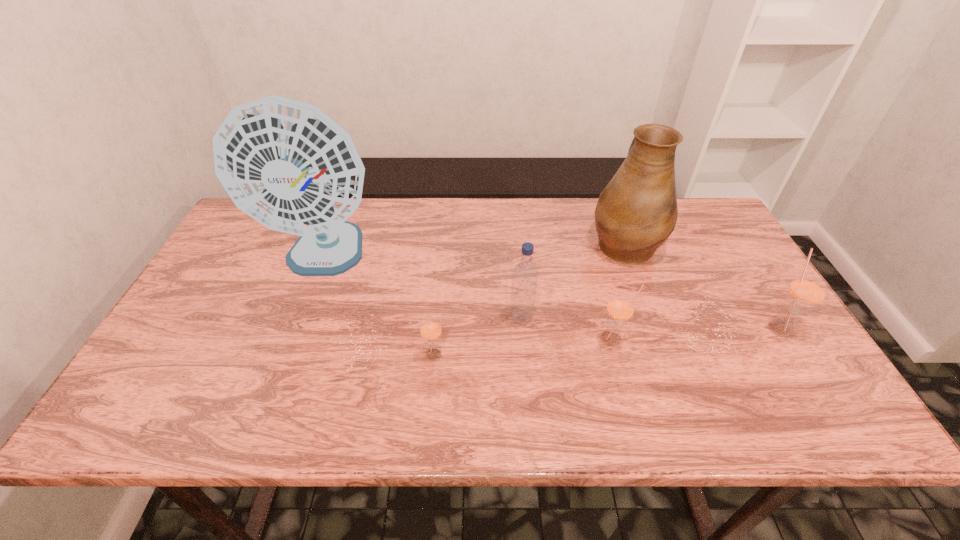
Given the evenly spaced straws in the image, where should an extra straw be added on the left to preserve the spacing? Please point to a vacant space. Please provide its 2D coordinates. Your answer should be formatted as a tuple, i.e. [(x, y)], where the tuple contains the x and y coordinates of a point satisfying the conditions above.

[(248, 370)]